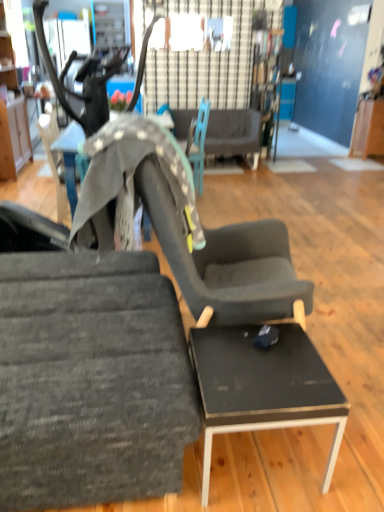
Question: Does wooden cabinet at left lie behind textured gray fabric chair at left, acting as the second chair starting from the back?

Choices:
 (A) yes
 (B) no

Answer: (A)

Question: Would you say wooden cabinet at left is a long distance from textured gray fabric chair at left, the 2th chair positioned from the top?

Choices:
 (A) no
 (B) yes

Answer: (B)

Question: Is wooden cabinet at left to the left of textured gray fabric chair at left, the 1th chair from the bottom, from the viewer's perspective?

Choices:
 (A) yes
 (B) no

Answer: (A)

Question: Can we say wooden cabinet at left lies outside textured gray fabric chair at left, the 1th chair from the bottom?

Choices:
 (A) no
 (B) yes

Answer: (B)

Question: Can you confirm if wooden cabinet at left is taller than textured gray fabric chair at left, the 2th chair positioned from the top?

Choices:
 (A) no
 (B) yes

Answer: (B)

Question: Does point (201, 113) appear closer or farther from the camera than point (180, 115)?

Choices:
 (A) closer
 (B) farther

Answer: (A)

Question: From the image's perspective, relative to dark gray fabric couch at center, is teal fabric chair at center, the second chair in the front-to-back sequence, above or below?

Choices:
 (A) below
 (B) above

Answer: (A)

Question: From their relative heights in the image, would you say teal fabric chair at center, which appears as the first chair when viewed from the top, is taller or shorter than dark gray fabric couch at center?

Choices:
 (A) tall
 (B) short

Answer: (A)

Question: Is teal fabric chair at center, which appears as the first chair when viewed from the top, situated inside dark gray fabric couch at center or outside?

Choices:
 (A) inside
 (B) outside

Answer: (B)

Question: From the image's perspective, is black glossy table at lower right located above or below teal fabric chair at center, the second chair in the front-to-back sequence?

Choices:
 (A) above
 (B) below

Answer: (B)

Question: Considering the positions of black glossy table at lower right and teal fabric chair at center, which appears as the first chair when viewed from the top, in the image, is black glossy table at lower right taller or shorter than teal fabric chair at center, which appears as the first chair when viewed from the top,?

Choices:
 (A) short
 (B) tall

Answer: (A)

Question: Considering the positions of black glossy table at lower right and teal fabric chair at center, which is counted as the 1th chair, starting from the back, in the image, is black glossy table at lower right wider or thinner than teal fabric chair at center, which is counted as the 1th chair, starting from the back,?

Choices:
 (A) thin
 (B) wide

Answer: (A)

Question: Do you think black glossy table at lower right is within teal fabric chair at center, which appears as the first chair when viewed from the top, or outside of it?

Choices:
 (A) outside
 (B) inside

Answer: (A)

Question: From a real-world perspective, is black glossy table at lower right positioned above or below textured gray fabric chair at left, arranged as the first chair when viewed from the front?

Choices:
 (A) above
 (B) below

Answer: (B)

Question: Relative to textured gray fabric chair at left, arranged as the first chair when viewed from the front, is black glossy table at lower right in front or behind?

Choices:
 (A) front
 (B) behind

Answer: (B)